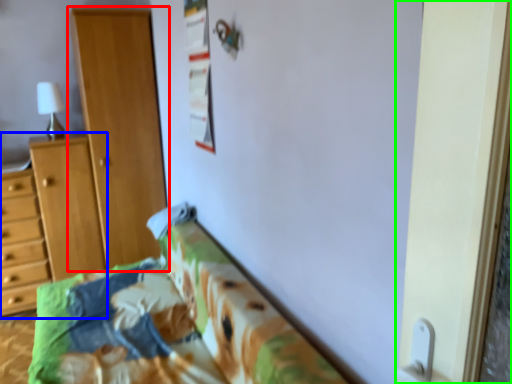
Question: Which is farther away from cupboard (highlighted by a red box)? vanity (highlighted by a blue box) or screen door (highlighted by a green box)?

Choices:
 (A) vanity
 (B) screen door

Answer: (B)